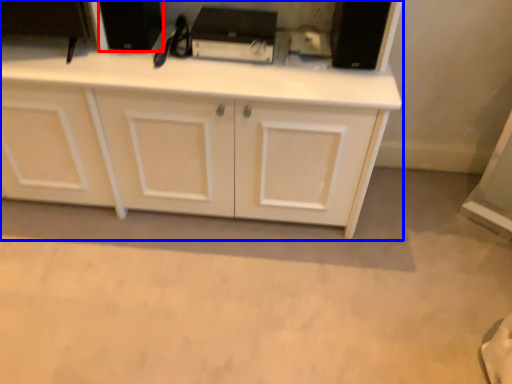
Question: Among these objects, which one is farthest to the camera, appliance (highlighted by a red box) or cabinetry (highlighted by a blue box)?

Choices:
 (A) appliance
 (B) cabinetry

Answer: (A)